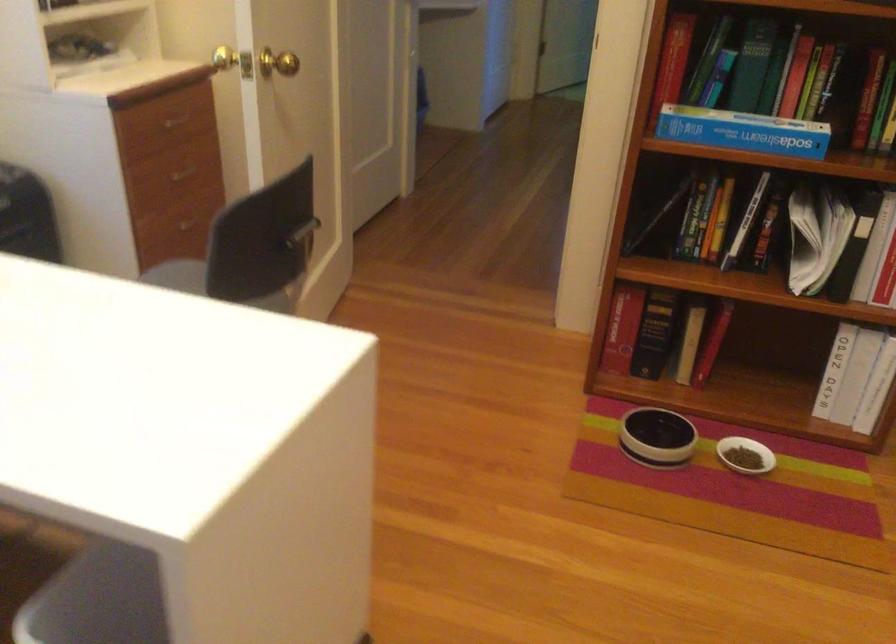
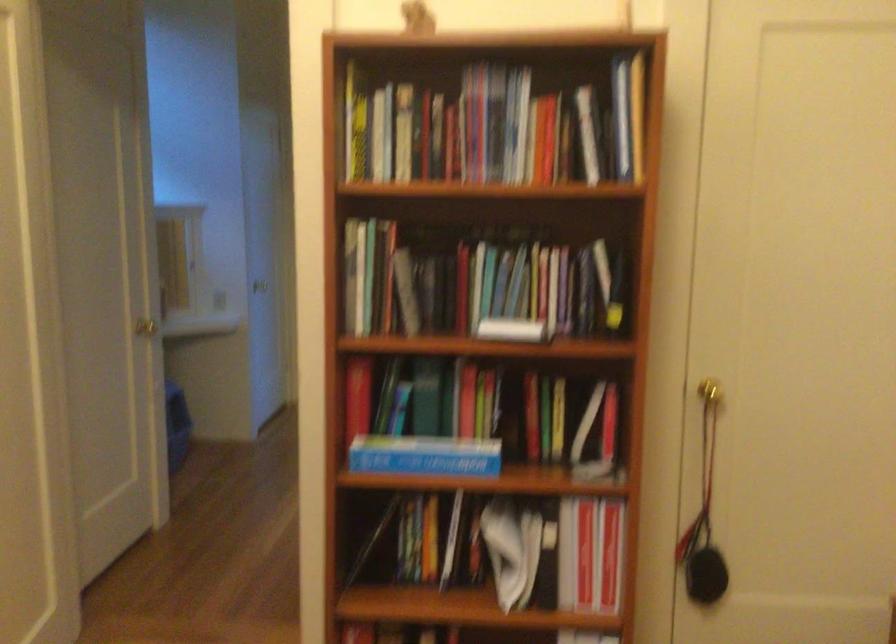
Question: The first image is from the beginning of the video and the second image is from the end. How did the camera likely rotate when shooting the video?

Choices:
 (A) Left
 (B) Right
 (C) Up
 (D) Down

Answer: (C)